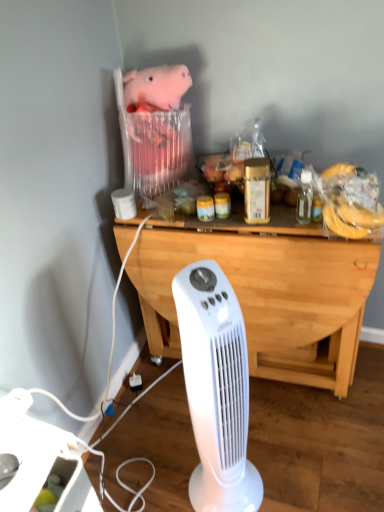
This screenshot has width=384, height=512. Find the location of `free space between white plastic fan at center and light wood/dark brown desk at center`. free space between white plastic fan at center and light wood/dark brown desk at center is located at coordinates tap(247, 428).